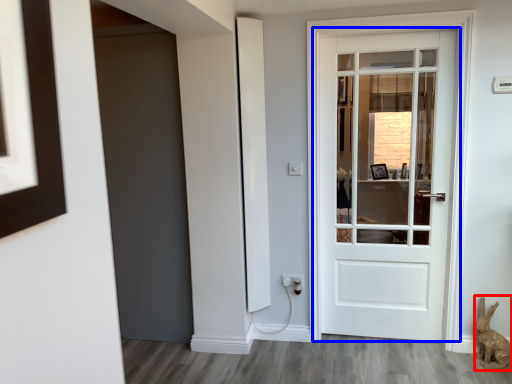
Question: Which object appears farthest to the camera in this image, animal (highlighted by a red box) or door (highlighted by a blue box)?

Choices:
 (A) animal
 (B) door

Answer: (B)